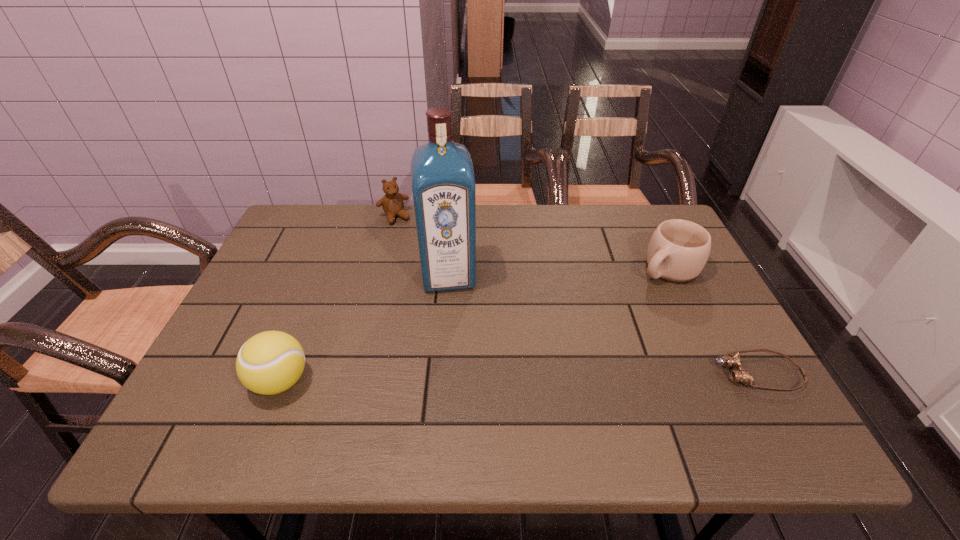
Identify the location of the leftmost object. (271, 362).

The height and width of the screenshot is (540, 960). In order to click on the shortest object in this screenshot , I will do `click(740, 375)`.

This screenshot has height=540, width=960. Find the location of `mug`. mug is located at coordinates (678, 250).

Locate an element on the screen. liquor is located at coordinates (443, 181).

This screenshot has height=540, width=960. What are the coordinates of `the tallest object` in the screenshot? It's located at (443, 181).

Locate an element on the screen. Image resolution: width=960 pixels, height=540 pixels. the farthest object is located at coordinates (392, 203).

Where is `teddy bear`? Image resolution: width=960 pixels, height=540 pixels. teddy bear is located at coordinates (392, 203).

Where is `vacant space located 0.400m on the right of the tennis ball`? vacant space located 0.400m on the right of the tennis ball is located at coordinates (499, 381).

This screenshot has height=540, width=960. Identify the location of vacant position located on the front lenses and sides of the goggles. (605, 373).

The image size is (960, 540). I want to click on free region located 0.310m on the front lenses and sides of the goggles, so click(x=572, y=373).